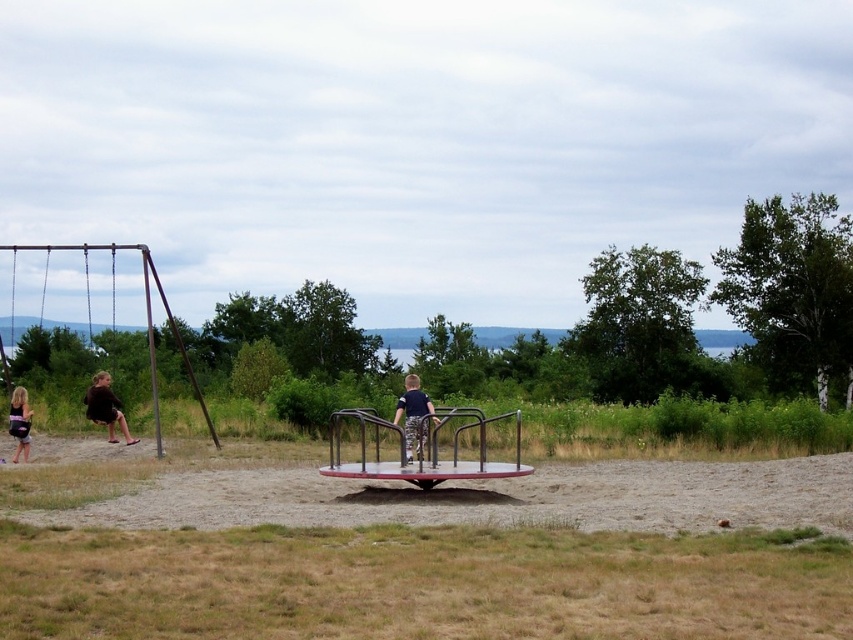
Question: Is brown sandy dirt at center wider than camouflage pants at center?

Choices:
 (A) no
 (B) yes

Answer: (B)

Question: Among these points, which one is farthest from the camera?

Choices:
 (A) (18, 436)
 (B) (543, 545)
 (C) (363, 488)
 (D) (109, 406)

Answer: (D)

Question: Which object appears farthest from the camera in this image?

Choices:
 (A) metallic swing at left
 (B) dark brown fabric pants at left

Answer: (B)

Question: Which object is the farthest from the matte black shorts at lower left?

Choices:
 (A) metallic swing at left
 (B) brown sandy dirt at center

Answer: (B)

Question: Does dark brown fabric pants at left lie in front of camouflage pants at center?

Choices:
 (A) no
 (B) yes

Answer: (A)

Question: Can you confirm if brown sandy dirt at center is positioned to the left of dark brown fabric pants at left?

Choices:
 (A) yes
 (B) no

Answer: (B)